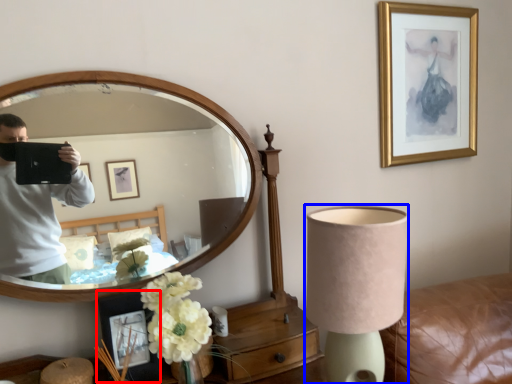
Question: Among these objects, which one is nearest to the camera, picture frame (highlighted by a red box) or lamp (highlighted by a blue box)?

Choices:
 (A) picture frame
 (B) lamp

Answer: (B)